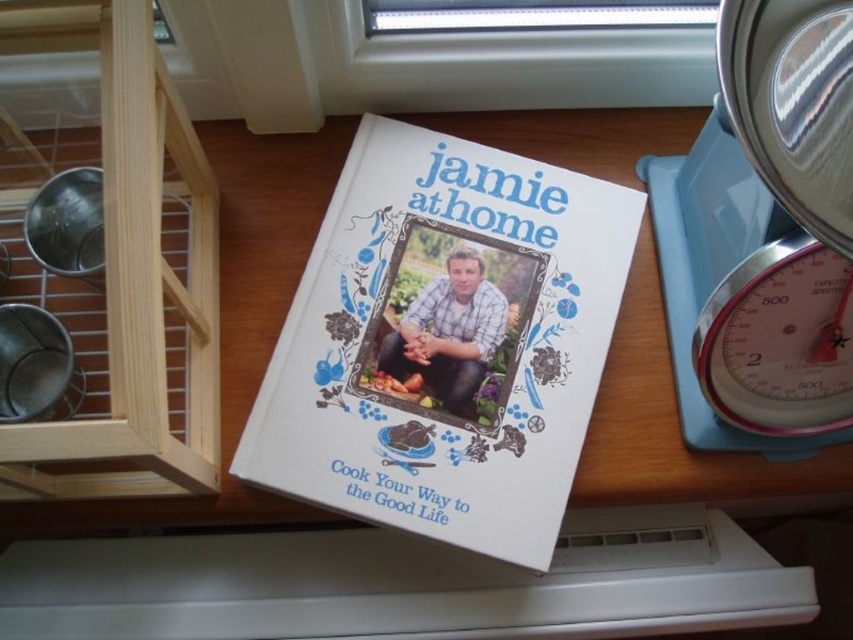
You are preparing to weigh ingredients for a recipe. You have the matte white book at center open to a page that requires you to measure flour. Where should you place the white plastic scale at right to measure the flour accurately?

To measure the flour accurately, place the white plastic scale at right to the right of the matte white book at center since the scale is already positioned to the right of the book.

You are a chef preparing to weigh ingredients for a recipe. You have the white plastic scale at right and the matte white book at center in front of you. Which object is closer to you?

The white plastic scale at right is closer to you because it is in front of the matte white book at center.

What is located at the coordinate point [763,234] in the image?

The blue plastic scale at right is located at coordinate point [763,234].